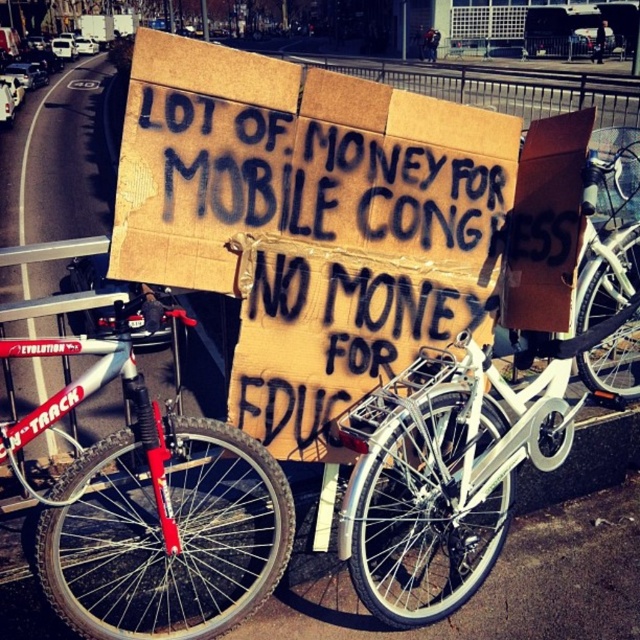
This screenshot has width=640, height=640. In order to click on cardboard sign at center in this screenshot , I will do `click(337, 221)`.

Between cardboard sign at center and white metallic bicycle at center, which one is positioned lower?

Positioned lower is white metallic bicycle at center.

You are a GUI agent. You are given a task and a screenshot of the screen. Output one action in this format:
    pyautogui.click(x=<x>, y=<y>)
    Task: Click on the cardboard sign at center
    The width and height of the screenshot is (640, 640).
    Given the screenshot: What is the action you would take?
    pyautogui.click(x=337, y=221)

How much distance is there between red matte bicycle at left and white metallic bicycle at center?

A distance of 76.13 centimeters exists between red matte bicycle at left and white metallic bicycle at center.

Between point (65, 506) and point (458, 436), which one is positioned in front?

Point (65, 506) is more forward.

What are the coordinates of `red matte bicycle at left` in the screenshot? It's located at (157, 518).

Does cardboard sign at center appear over white matte bicycle at center?

Actually, cardboard sign at center is below white matte bicycle at center.

Is cardboard sign at center thinner than white matte bicycle at center?

Incorrect, cardboard sign at center's width is not less than white matte bicycle at center's.

Does point (554, 291) come behind point (627, 177)?

No, (554, 291) is closer to viewer.

Identify the location of cardboard sign at center. This screenshot has height=640, width=640. (337, 221).